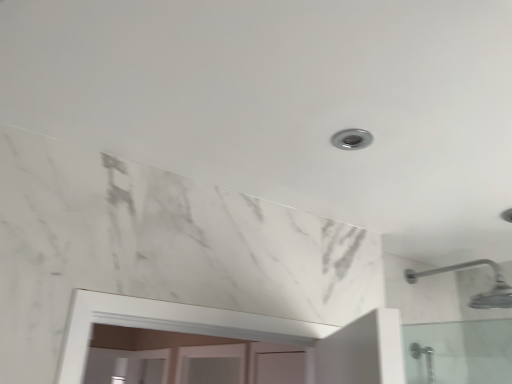
Measure the distance between satin nickel droplight at upper center and camera.

satin nickel droplight at upper center is 35.77 inches from camera.

Identify the location of satin nickel droplight at upper center. (352, 139).

What do you see at coordinates (352, 139) in the screenshot?
I see `satin nickel droplight at upper center` at bounding box center [352, 139].

This screenshot has width=512, height=384. Identify the location of satin nickel droplight at upper center. (352, 139).